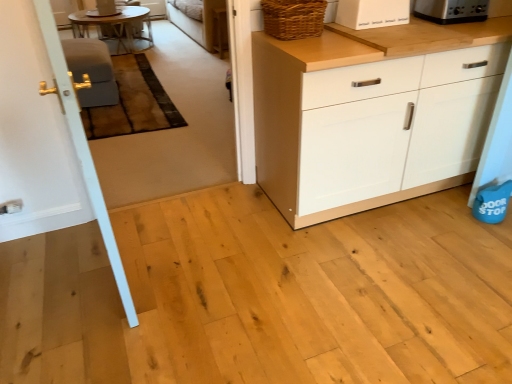
Question: From a real-world perspective, is white matte bread box at upper right, which appears as the third appliance when viewed from the top, under metallic silver toaster at upper left, acting as the third appliance starting from the right?

Choices:
 (A) no
 (B) yes

Answer: (A)

Question: Can you confirm if white matte bread box at upper right, which is the second appliance in right-to-left order, is taller than metallic silver toaster at upper left, the 3th appliance from the bottom?

Choices:
 (A) yes
 (B) no

Answer: (B)

Question: Is white matte bread box at upper right, which is the second appliance in right-to-left order, behind metallic silver toaster at upper left, marked as the first appliance in a left-to-right arrangement?

Choices:
 (A) yes
 (B) no

Answer: (B)

Question: Is white matte bread box at upper right, which is the first appliance from bottom to top, wider than metallic silver toaster at upper left, the 3th appliance from the bottom?

Choices:
 (A) no
 (B) yes

Answer: (A)

Question: Is white matte bread box at upper right, which is the 2th appliance from left to right, to the left of metallic silver toaster at upper left, the 3th appliance from the bottom, from the viewer's perspective?

Choices:
 (A) no
 (B) yes

Answer: (A)

Question: Are white matte bread box at upper right, which is the 1th appliance in front-to-back order, and metallic silver toaster at upper left, which is counted as the 3th appliance, starting from the front, located far from each other?

Choices:
 (A) no
 (B) yes

Answer: (B)

Question: Considering the relative sizes of woven brown basket at upper right and metallic silver toaster at upper left, the 3th appliance from the bottom, in the image provided, is woven brown basket at upper right thinner than metallic silver toaster at upper left, the 3th appliance from the bottom,?

Choices:
 (A) yes
 (B) no

Answer: (A)

Question: Is woven brown basket at upper right closer to the viewer compared to metallic silver toaster at upper left, which is the 1th appliance from back to front?

Choices:
 (A) yes
 (B) no

Answer: (A)

Question: Does woven brown basket at upper right have a lesser height compared to metallic silver toaster at upper left, marked as the first appliance in a left-to-right arrangement?

Choices:
 (A) no
 (B) yes

Answer: (B)

Question: Is metallic silver toaster at upper left, acting as the third appliance starting from the right, inside woven brown basket at upper right?

Choices:
 (A) no
 (B) yes

Answer: (A)

Question: Could you tell me if woven brown basket at upper right is turned towards metallic silver toaster at upper left, marked as the first appliance in a left-to-right arrangement?

Choices:
 (A) yes
 (B) no

Answer: (B)

Question: Can you confirm if woven brown basket at upper right is wider than metallic silver toaster at upper left, which is counted as the 3th appliance, starting from the front?

Choices:
 (A) yes
 (B) no

Answer: (B)

Question: Can you confirm if white matte bread box at upper right, which is the second appliance in right-to-left order, is bigger than matte gray armchair at left?

Choices:
 (A) no
 (B) yes

Answer: (A)